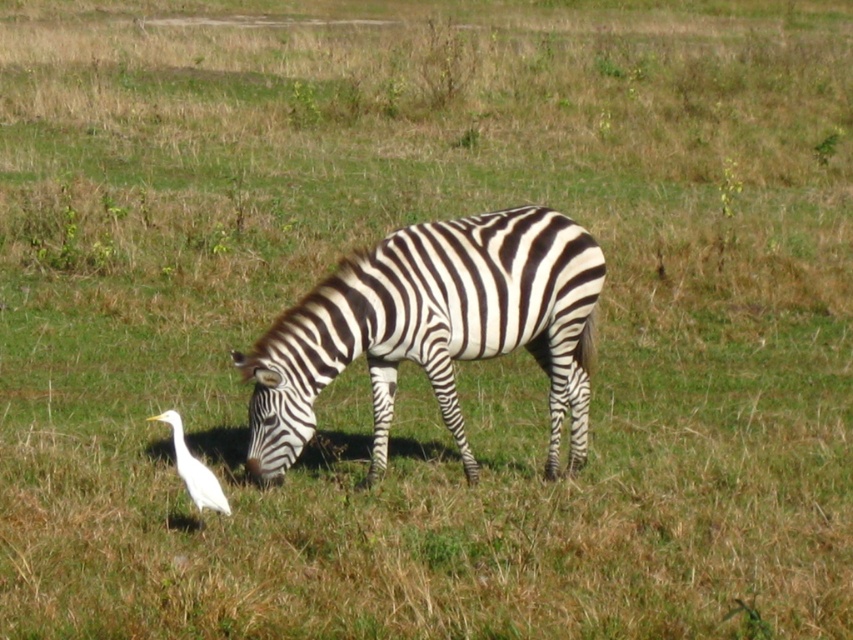
You are a photographer trying to capture a photo of the black and white striped zebra at center and the white matte bird at lower left. You want to ensure both subjects are in focus. Since the zebra is taller than the bird, which subject should you focus on first to ensure proper depth of field?

The black and white striped zebra at center is taller than the white matte bird at lower left. To ensure proper depth of field, focus on the taller subject first, which is the black and white striped zebra at center, then adjust for the bird.

You are a photographer trying to capture a photo of the black and white striped zebra at center and the white matte bird at lower left. If you want to ensure both subjects are in focus, which one should you focus on first considering their positions?

The black and white striped zebra at center is located above the white matte bird at lower left, so you should focus on the black and white striped zebra at center first as it is closer to the camera.